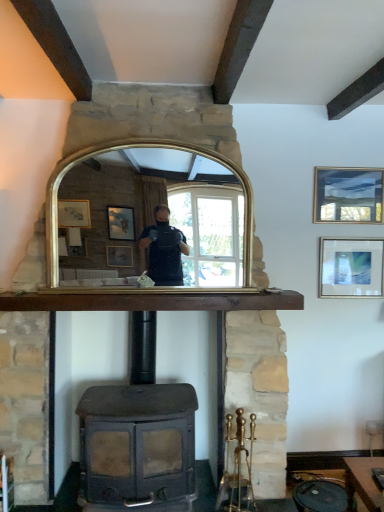
Question: From a real-world perspective, is brown wooden mantle at center located higher than matte gold picture frame at upper right, which ranks as the 1th picture frame in top-to-bottom order?

Choices:
 (A) yes
 (B) no

Answer: (B)

Question: Considering the relative positions of brown wooden mantle at center and matte gold picture frame at upper right, the second picture frame ordered from the bottom, in the image provided, is brown wooden mantle at center to the left of matte gold picture frame at upper right, the second picture frame ordered from the bottom, from the viewer's perspective?

Choices:
 (A) yes
 (B) no

Answer: (A)

Question: Does brown wooden mantle at center have a lesser width compared to matte gold picture frame at upper right, the second picture frame ordered from the bottom?

Choices:
 (A) yes
 (B) no

Answer: (B)

Question: Does brown wooden mantle at center touch matte gold picture frame at upper right, which ranks as the 1th picture frame in top-to-bottom order?

Choices:
 (A) no
 (B) yes

Answer: (A)

Question: Is brown wooden mantle at center wider than matte gold picture frame at upper right, which ranks as the 1th picture frame in top-to-bottom order?

Choices:
 (A) no
 (B) yes

Answer: (B)

Question: In the image, is matte silver picture frame at upper right, the first picture frame in the bottom-to-top sequence, positioned in front of or behind brown wooden mantle at center?

Choices:
 (A) front
 (B) behind

Answer: (B)

Question: Is matte silver picture frame at upper right, the first picture frame in the bottom-to-top sequence, inside the boundaries of brown wooden mantle at center, or outside?

Choices:
 (A) outside
 (B) inside

Answer: (A)

Question: From the image's perspective, is matte silver picture frame at upper right, which appears as the second picture frame when viewed from the top, located above or below brown wooden mantle at center?

Choices:
 (A) above
 (B) below

Answer: (A)

Question: From a real-world perspective, relative to brown wooden mantle at center, is matte silver picture frame at upper right, which appears as the second picture frame when viewed from the top, vertically above or below?

Choices:
 (A) below
 (B) above

Answer: (B)

Question: Would you say gold-framed mirror at center is inside or outside matte gold picture frame at upper right, the second picture frame ordered from the bottom?

Choices:
 (A) outside
 (B) inside

Answer: (A)

Question: Is point (233, 247) positioned closer to the camera than point (332, 181)?

Choices:
 (A) farther
 (B) closer

Answer: (B)

Question: In the image, is gold-framed mirror at center positioned in front of or behind matte gold picture frame at upper right, which ranks as the 1th picture frame in top-to-bottom order?

Choices:
 (A) front
 (B) behind

Answer: (A)

Question: Is gold-framed mirror at center wider or thinner than matte gold picture frame at upper right, the second picture frame ordered from the bottom?

Choices:
 (A) wide
 (B) thin

Answer: (A)

Question: From a real-world perspective, is matte black wood burning stove at center above or below matte gold picture frame at upper right, the second picture frame ordered from the bottom?

Choices:
 (A) above
 (B) below

Answer: (B)

Question: Visually, is matte black wood burning stove at center positioned to the left or to the right of matte gold picture frame at upper right, which ranks as the 1th picture frame in top-to-bottom order?

Choices:
 (A) left
 (B) right

Answer: (A)